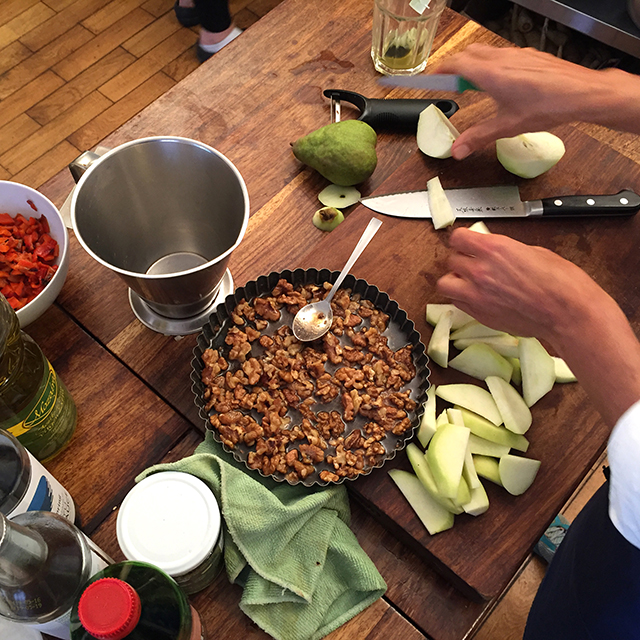
Locate an element on the screen. towel is located at coordinates (292, 592).